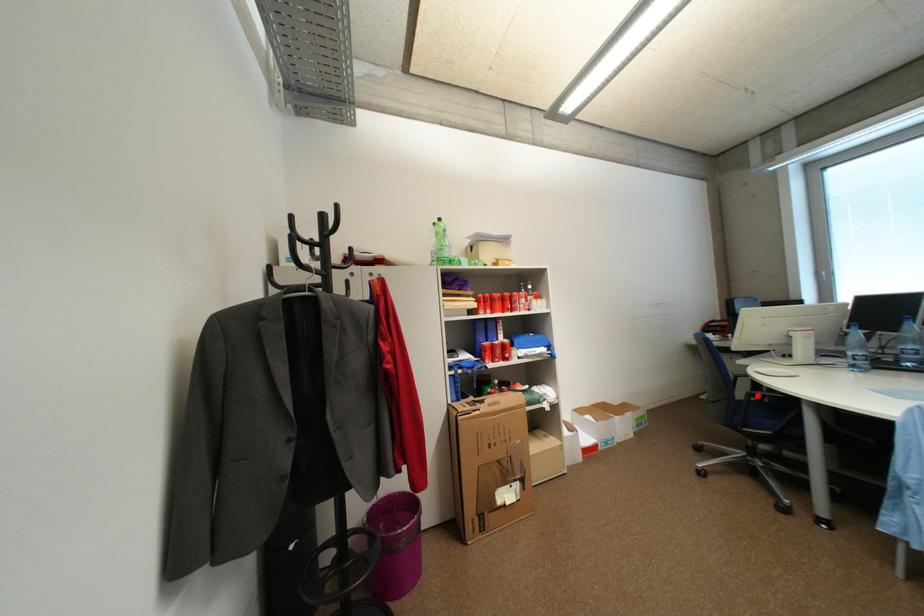
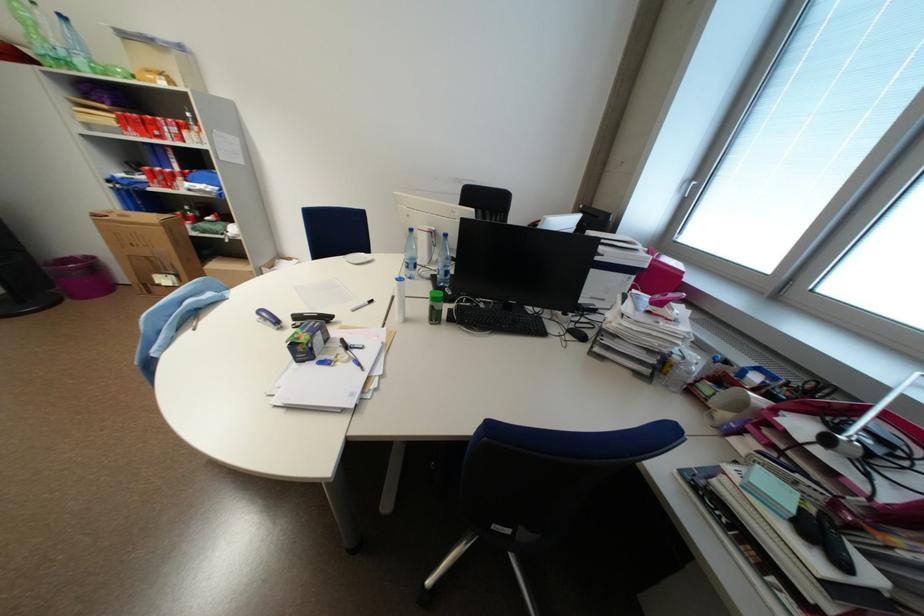
Question: I am providing you with two images of the same scene from different viewpoints. A red point is marked on the first image. Is the red point's position out of view in image 2?

Choices:
 (A) Yes
 (B) No

Answer: (A)